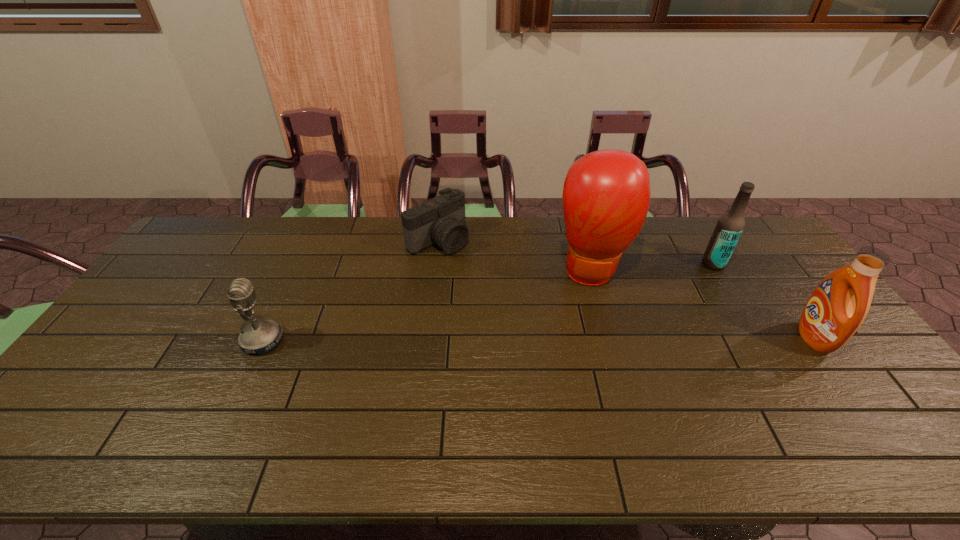
Find the location of a particular element. The height and width of the screenshot is (540, 960). free spot on the desktop that is between the fourth tallest object and the rightmost object and is positioned on the striking surface of the boxing glove is located at coordinates (598, 339).

This screenshot has width=960, height=540. I want to click on vacant space on the desktop that is between the second shortest object and the rightmost object and is positioned on the side of the second object from right to left with the label, so click(586, 339).

Locate an element on the screen. This screenshot has height=540, width=960. free spot on the desktop that is between the second shortest object and the rightmost object and is positioned at the lens of the second object from left to right is located at coordinates (568, 339).